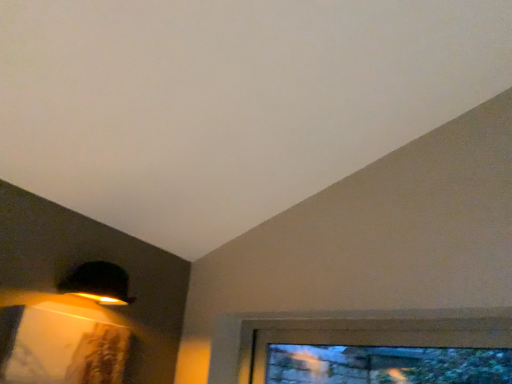
Question: Is clear glass window at lower right surrounding matte black lampshade at upper left?

Choices:
 (A) no
 (B) yes

Answer: (A)

Question: Is clear glass window at lower right facing towards matte black lampshade at upper left?

Choices:
 (A) no
 (B) yes

Answer: (B)

Question: Is clear glass window at lower right outside of matte black lampshade at upper left?

Choices:
 (A) yes
 (B) no

Answer: (A)

Question: From a real-world perspective, is clear glass window at lower right under matte black lampshade at upper left?

Choices:
 (A) yes
 (B) no

Answer: (A)

Question: Can you confirm if clear glass window at lower right is bigger than matte black lampshade at upper left?

Choices:
 (A) yes
 (B) no

Answer: (A)

Question: Is clear glass window at lower right in front of matte black lampshade at upper left?

Choices:
 (A) no
 (B) yes

Answer: (B)

Question: Is matte black lampshade at upper left at the right side of clear glass window at lower right?

Choices:
 (A) yes
 (B) no

Answer: (B)

Question: From a real-world perspective, is matte black lampshade at upper left located higher than clear glass window at lower right?

Choices:
 (A) no
 (B) yes

Answer: (B)

Question: Could you tell me if matte black lampshade at upper left is turned towards clear glass window at lower right?

Choices:
 (A) yes
 (B) no

Answer: (B)

Question: Is matte black lampshade at upper left bigger than clear glass window at lower right?

Choices:
 (A) yes
 (B) no

Answer: (B)

Question: Considering the relative sizes of matte black lampshade at upper left and clear glass window at lower right in the image provided, is matte black lampshade at upper left thinner than clear glass window at lower right?

Choices:
 (A) yes
 (B) no

Answer: (B)

Question: Is matte black lampshade at upper left facing away from clear glass window at lower right?

Choices:
 (A) no
 (B) yes

Answer: (A)

Question: From the image's perspective, is clear glass window at lower right located above or below matte black lampshade at upper left?

Choices:
 (A) above
 (B) below

Answer: (B)